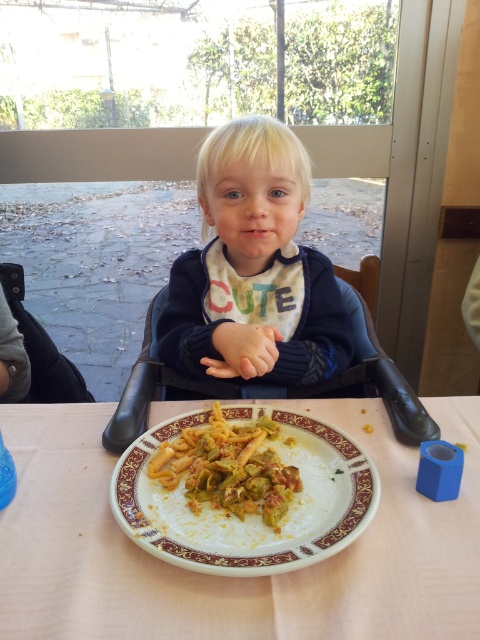
Does point (120, 564) come closer to viewer compared to point (205, 492)?

Yes, it is.

Who is more distant from viewer, [467,442] or [278,465]?

Positioned behind is point [467,442].

Is point (162, 596) positioned before point (156, 472)?

Yes, it is.

Find the location of `white ceramic plate at center`. white ceramic plate at center is located at coordinates (229, 577).

From the picture: Does cute sweater at center appear on the left side of yellowish matte pasta at center?

Correct, you'll find cute sweater at center to the left of yellowish matte pasta at center.

Between point (216, 164) and point (257, 470), which one is positioned behind?

Positioned behind is point (216, 164).

Between point (235, 250) and point (243, 481), which one is positioned behind?

The point (235, 250) is more distant.

Find the location of `cute sweater at center`. cute sweater at center is located at coordinates (253, 268).

Does cute sweater at center have a lesser height compared to white glossy plate at lower center?

No, cute sweater at center is not shorter than white glossy plate at lower center.

Is cute sweater at center to the left of white glossy plate at lower center from the viewer's perspective?

Indeed, cute sweater at center is positioned on the left side of white glossy plate at lower center.

Which is behind, point (247, 340) or point (148, 483)?

Point (247, 340)

Where is `cute sweater at center`? cute sweater at center is located at coordinates (253, 268).